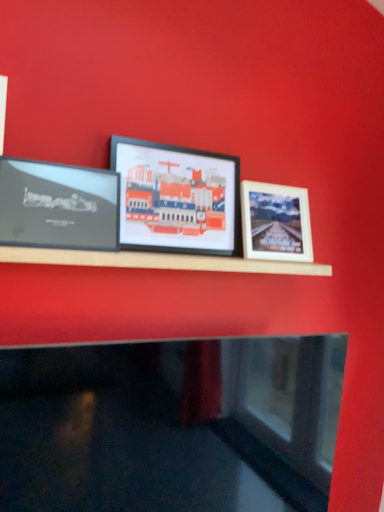
Describe the element at coordinates (58, 206) in the screenshot. I see `matte black frame at left, the third picture frame in the right-to-left sequence` at that location.

What do you see at coordinates (177, 198) in the screenshot? This screenshot has height=512, width=384. I see `matte black picture frame at center, the second picture frame in the right-to-left sequence` at bounding box center [177, 198].

Describe the element at coordinates (275, 222) in the screenshot. I see `white matte picture frame at right, which ranks as the 1th picture frame in right-to-left order` at that location.

This screenshot has height=512, width=384. I want to click on matte black frame at left, acting as the first picture frame starting from the left, so click(58, 206).

Can you tell me how much matte black picture frame at center, marked as the 2th picture frame in a left-to-right arrangement, and matte black frame at left, acting as the first picture frame starting from the left, differ in facing direction?

The facing directions of matte black picture frame at center, marked as the 2th picture frame in a left-to-right arrangement, and matte black frame at left, acting as the first picture frame starting from the left, are 3.16 degrees apart.

Would you say matte black picture frame at center, marked as the 2th picture frame in a left-to-right arrangement, is outside matte black frame at left, the third picture frame in the right-to-left sequence?

Yes.

Considering the sizes of objects matte black picture frame at center, marked as the 2th picture frame in a left-to-right arrangement, and matte black frame at left, acting as the first picture frame starting from the left, in the image provided, who is bigger, matte black picture frame at center, marked as the 2th picture frame in a left-to-right arrangement, or matte black frame at left, acting as the first picture frame starting from the left,?

matte black picture frame at center, marked as the 2th picture frame in a left-to-right arrangement.

Which is closer to the camera, (196, 218) or (64, 217)?

Positioned in front is point (64, 217).

Are white matte picture frame at right, which ranks as the 1th picture frame in right-to-left order, and matte black picture frame at center, marked as the 2th picture frame in a left-to-right arrangement, located far from each other?

No, white matte picture frame at right, which ranks as the 1th picture frame in right-to-left order, is in close proximity to matte black picture frame at center, marked as the 2th picture frame in a left-to-right arrangement.

Is white matte picture frame at right, the 3th picture frame viewed from the left, to the left of matte black picture frame at center, marked as the 2th picture frame in a left-to-right arrangement, from the viewer's perspective?

No, white matte picture frame at right, the 3th picture frame viewed from the left, is not to the left of matte black picture frame at center, marked as the 2th picture frame in a left-to-right arrangement.

From a real-world perspective, which is physically above, white matte picture frame at right, the 3th picture frame viewed from the left, or matte black picture frame at center, marked as the 2th picture frame in a left-to-right arrangement?

From a 3D spatial view, matte black picture frame at center, marked as the 2th picture frame in a left-to-right arrangement, is above.

Between white matte picture frame at right, the 3th picture frame viewed from the left, and matte black picture frame at center, the second picture frame in the right-to-left sequence, which one has larger width?

Wider between the two is white matte picture frame at right, the 3th picture frame viewed from the left.

Between white matte picture frame at right, which ranks as the 1th picture frame in right-to-left order, and matte black frame at left, the third picture frame in the right-to-left sequence, which one has less height?

With less height is matte black frame at left, the third picture frame in the right-to-left sequence.

From a real-world perspective, which is physically below, white matte picture frame at right, the 3th picture frame viewed from the left, or matte black frame at left, acting as the first picture frame starting from the left?

matte black frame at left, acting as the first picture frame starting from the left.

Which is in front, white matte picture frame at right, the 3th picture frame viewed from the left, or matte black frame at left, acting as the first picture frame starting from the left?

matte black frame at left, acting as the first picture frame starting from the left, is in front.

Is white matte picture frame at right, the 3th picture frame viewed from the left, to the right of matte black frame at left, acting as the first picture frame starting from the left, from the viewer's perspective?

Yes.

Does matte black picture frame at center, marked as the 2th picture frame in a left-to-right arrangement, come in front of white matte picture frame at right, the 3th picture frame viewed from the left?

Yes, it is in front of white matte picture frame at right, the 3th picture frame viewed from the left.

Can we say matte black picture frame at center, the second picture frame in the right-to-left sequence, lies outside white matte picture frame at right, which ranks as the 1th picture frame in right-to-left order?

Yes, matte black picture frame at center, the second picture frame in the right-to-left sequence, is located beyond the bounds of white matte picture frame at right, which ranks as the 1th picture frame in right-to-left order.

Who is smaller, matte black picture frame at center, the second picture frame in the right-to-left sequence, or white matte picture frame at right, the 3th picture frame viewed from the left?

white matte picture frame at right, the 3th picture frame viewed from the left, is smaller.

Are matte black frame at left, acting as the first picture frame starting from the left, and matte black picture frame at center, marked as the 2th picture frame in a left-to-right arrangement, located far from each other?

No, there isn't a large distance between matte black frame at left, acting as the first picture frame starting from the left, and matte black picture frame at center, marked as the 2th picture frame in a left-to-right arrangement.

Locate an element on the screen. the 2nd picture frame directly above the matte black frame at left, the third picture frame in the right-to-left sequence (from a real-world perspective) is located at coordinates (177, 198).

From a real-world perspective, who is located lower, matte black frame at left, the third picture frame in the right-to-left sequence, or matte black picture frame at center, marked as the 2th picture frame in a left-to-right arrangement?

From a 3D spatial view, matte black frame at left, the third picture frame in the right-to-left sequence, is below.

From the image's perspective, between matte black frame at left, the third picture frame in the right-to-left sequence, and matte black picture frame at center, marked as the 2th picture frame in a left-to-right arrangement, who is located below?

matte black frame at left, the third picture frame in the right-to-left sequence, from the image's perspective.

Based on the photo, is matte black frame at left, the third picture frame in the right-to-left sequence, thinner than white matte picture frame at right, the 3th picture frame viewed from the left?

Yes, matte black frame at left, the third picture frame in the right-to-left sequence, is thinner than white matte picture frame at right, the 3th picture frame viewed from the left.

Is matte black frame at left, the third picture frame in the right-to-left sequence, facing towards white matte picture frame at right, which ranks as the 1th picture frame in right-to-left order?

No, matte black frame at left, the third picture frame in the right-to-left sequence, is not turned towards white matte picture frame at right, which ranks as the 1th picture frame in right-to-left order.

Identify the location of the 1st picture frame positioned above the white matte picture frame at right, the 3th picture frame viewed from the left (from the image's perspective). The height and width of the screenshot is (512, 384). (58, 206).

Which is in front, matte black frame at left, the third picture frame in the right-to-left sequence, or white matte picture frame at right, the 3th picture frame viewed from the left?

matte black frame at left, the third picture frame in the right-to-left sequence, is more forward.

Identify the location of the 2nd picture frame above the matte black frame at left, acting as the first picture frame starting from the left (from a real-world perspective). The width and height of the screenshot is (384, 512). (177, 198).

Find the location of a particular element. picture frame that is the 2nd object located below the matte black picture frame at center, the second picture frame in the right-to-left sequence (from the image's perspective) is located at coordinates (275, 222).

Which object lies further to the anchor point matte black picture frame at center, the second picture frame in the right-to-left sequence, white matte picture frame at right, which ranks as the 1th picture frame in right-to-left order, or matte black frame at left, the third picture frame in the right-to-left sequence?

matte black frame at left, the third picture frame in the right-to-left sequence, is further to matte black picture frame at center, the second picture frame in the right-to-left sequence.

When comparing their distances from matte black picture frame at center, the second picture frame in the right-to-left sequence, does matte black frame at left, the third picture frame in the right-to-left sequence, or white matte picture frame at right, which ranks as the 1th picture frame in right-to-left order, seem closer?

white matte picture frame at right, which ranks as the 1th picture frame in right-to-left order.

Looking at this image, based on their spatial positions, is matte black picture frame at center, the second picture frame in the right-to-left sequence, or white matte picture frame at right, the 3th picture frame viewed from the left, closer to matte black frame at left, the third picture frame in the right-to-left sequence?

Among the two, matte black picture frame at center, the second picture frame in the right-to-left sequence, is located nearer to matte black frame at left, the third picture frame in the right-to-left sequence.

Considering their positions, is matte black picture frame at center, marked as the 2th picture frame in a left-to-right arrangement, positioned further to white matte picture frame at right, the 3th picture frame viewed from the left, than matte black frame at left, acting as the first picture frame starting from the left?

Based on the image, matte black frame at left, acting as the first picture frame starting from the left, appears to be further to white matte picture frame at right, the 3th picture frame viewed from the left.

Estimate the real-world distances between objects in this image. Which object is closer to matte black frame at left, the third picture frame in the right-to-left sequence, white matte picture frame at right, the 3th picture frame viewed from the left, or matte black picture frame at center, the second picture frame in the right-to-left sequence?

matte black picture frame at center, the second picture frame in the right-to-left sequence, lies closer to matte black frame at left, the third picture frame in the right-to-left sequence, than the other object.

Estimate the real-world distances between objects in this image. Which object is further from white matte picture frame at right, the 3th picture frame viewed from the left, matte black frame at left, acting as the first picture frame starting from the left, or matte black picture frame at center, marked as the 2th picture frame in a left-to-right arrangement?

matte black frame at left, acting as the first picture frame starting from the left.

Locate an element on the screen. This screenshot has height=512, width=384. picture frame between matte black frame at left, the third picture frame in the right-to-left sequence, and white matte picture frame at right, the 3th picture frame viewed from the left is located at coordinates (177, 198).